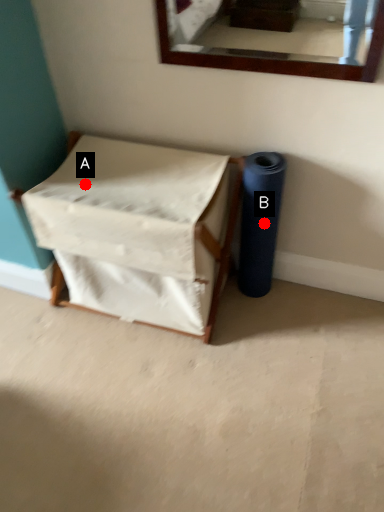
Question: Two points are circled on the image, labeled by A and B beside each circle. Among these points, which one is nearest to the camera?

Choices:
 (A) A is closer
 (B) B is closer

Answer: (A)